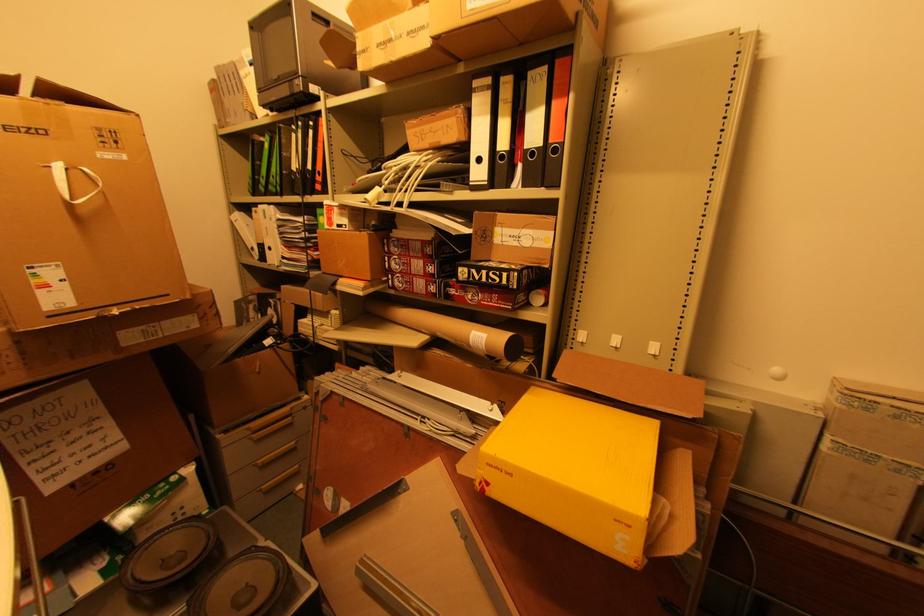
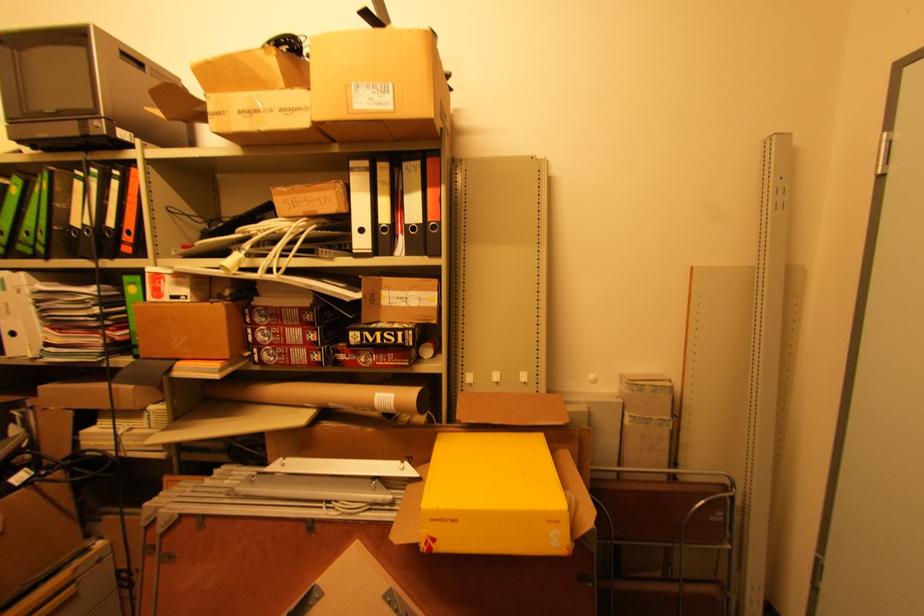
In the second image, find the point that corresponds to the point at 536,155 in the first image.

(417, 229)